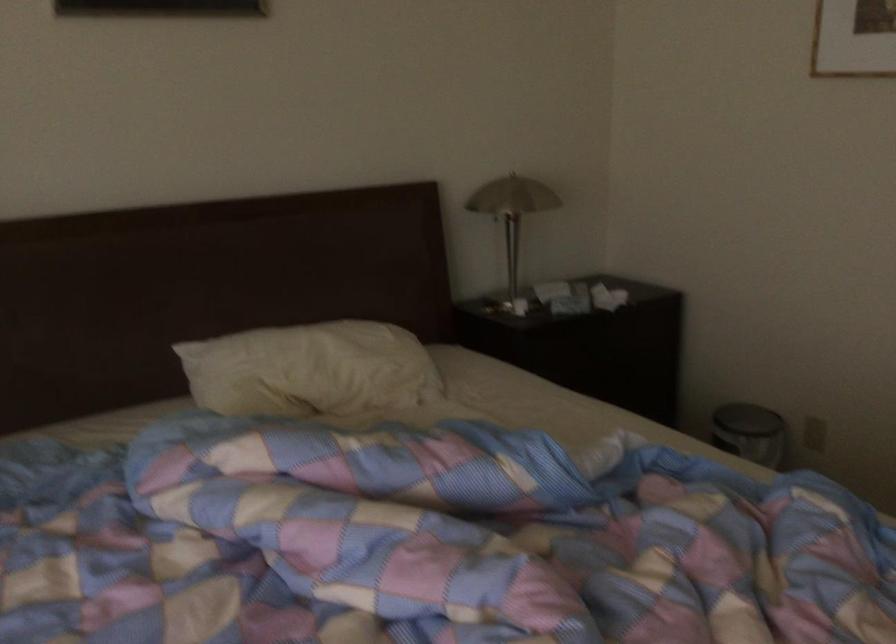
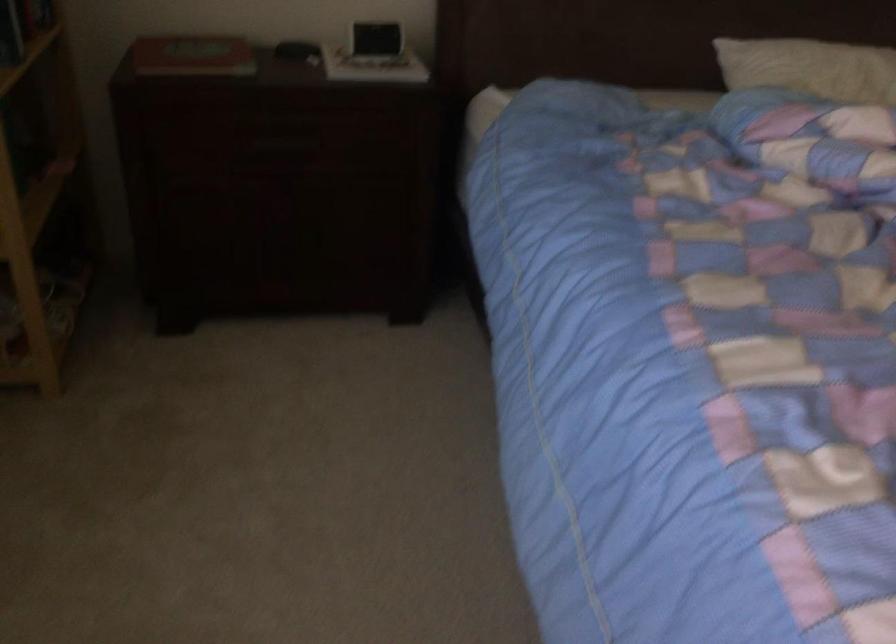
In a continuous first-person perspective shot, in which direction is the camera moving?

The cameraman moved toward left, backward.